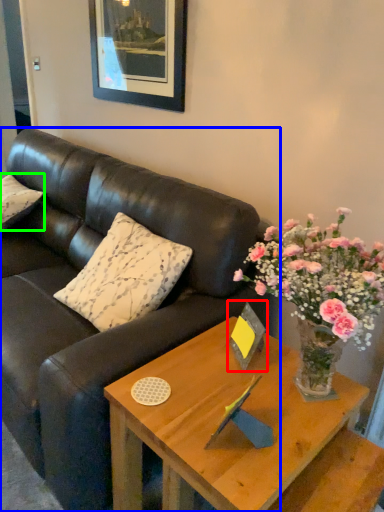
Question: Considering the real-world distances, which object is farthest from picture frame (highlighted by a red box)? studio couch (highlighted by a blue box) or pillow (highlighted by a green box)?

Choices:
 (A) studio couch
 (B) pillow

Answer: (B)